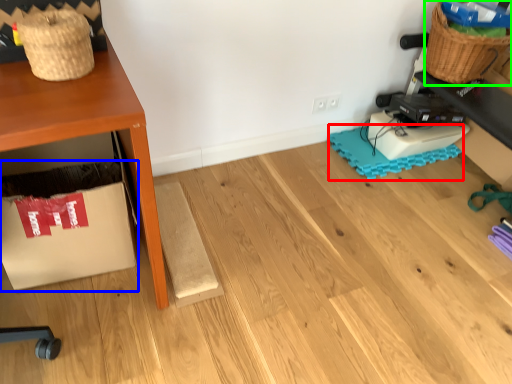
Question: Which object is positioned farthest from mat (highlighted by a red box)? Select from cardboard box (highlighted by a blue box) and basket (highlighted by a green box).

Choices:
 (A) cardboard box
 (B) basket

Answer: (A)